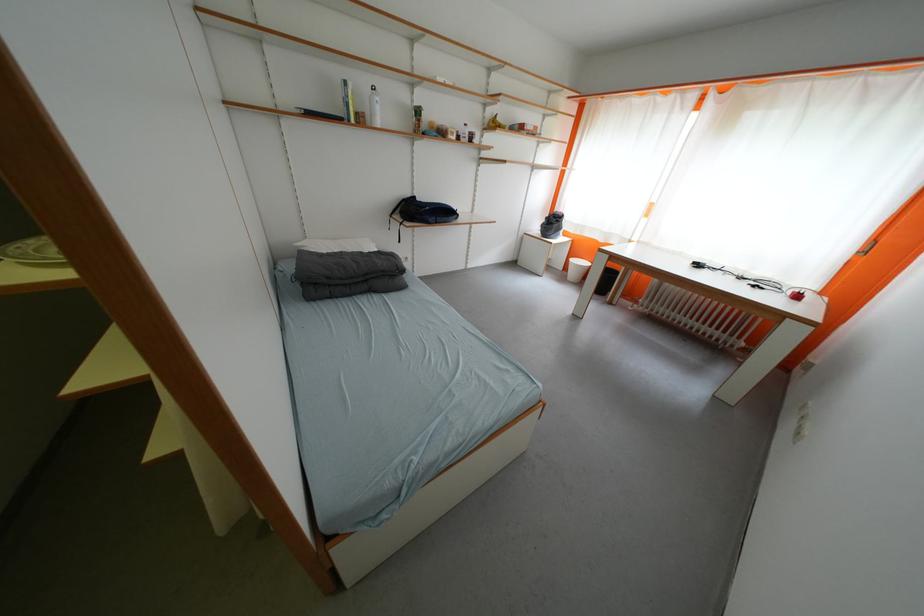
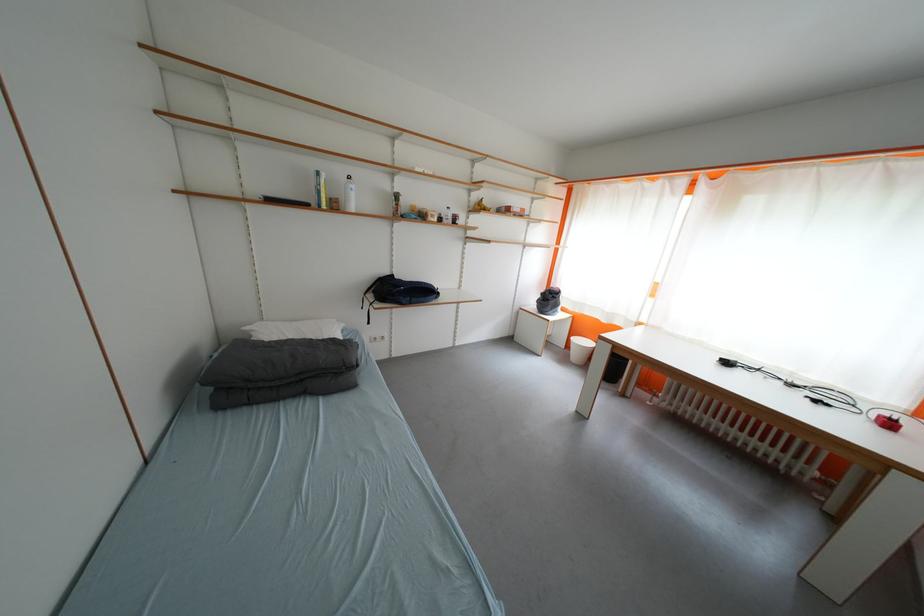
Locate, in the second image, the point that corresponds to point 423,201 in the first image.

(400, 278)